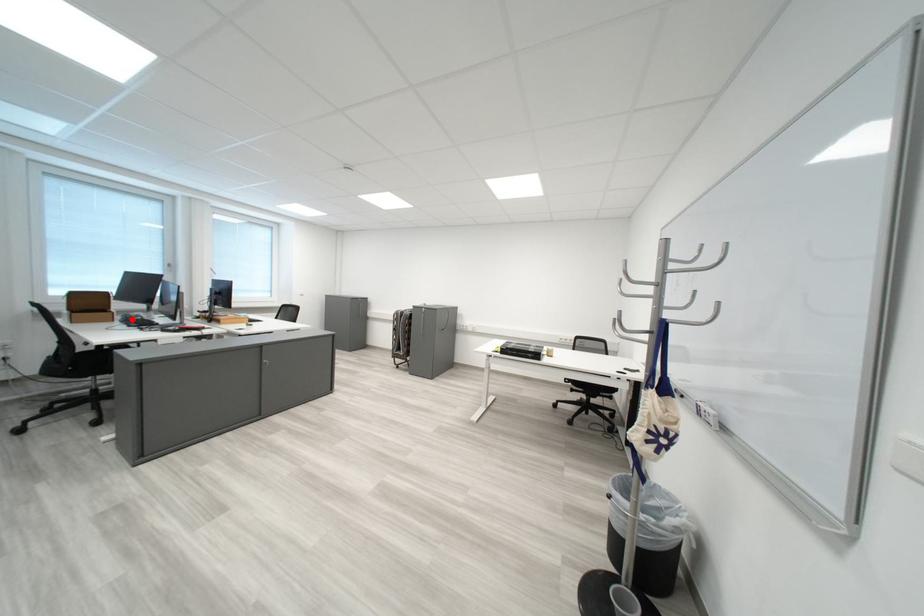
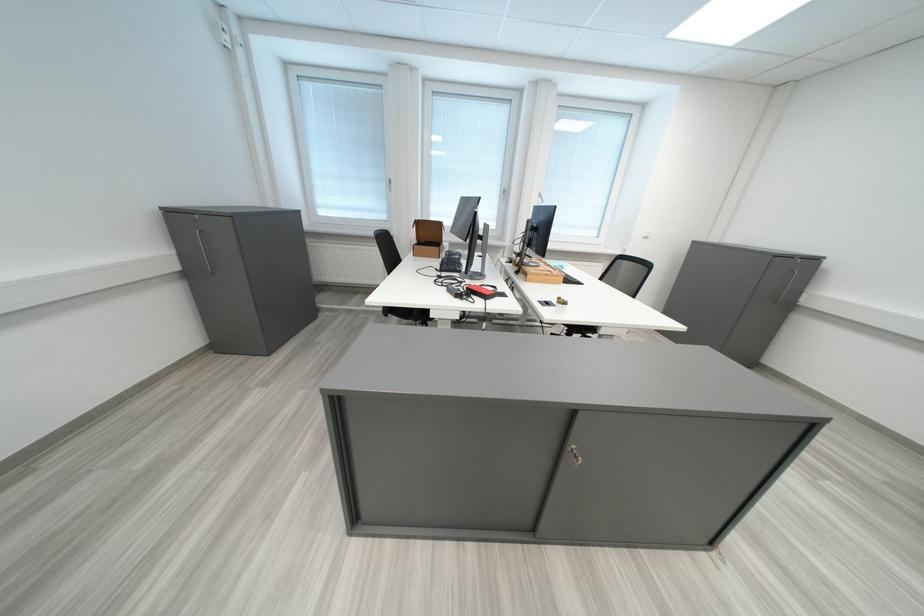
The point at the highlighted location is marked in the first image. Where is the corresponding point in the second image?

(456, 256)